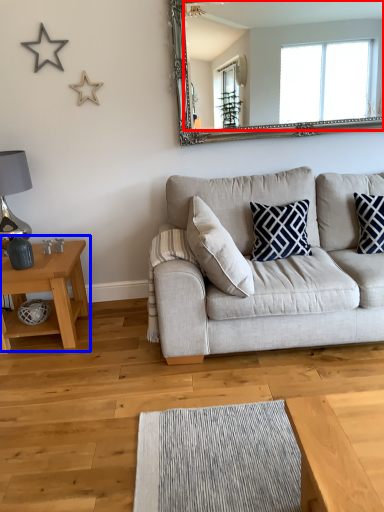
Question: Among these objects, which one is nearest to the camera, mirror (highlighted by a red box) or table (highlighted by a blue box)?

Choices:
 (A) mirror
 (B) table

Answer: (B)